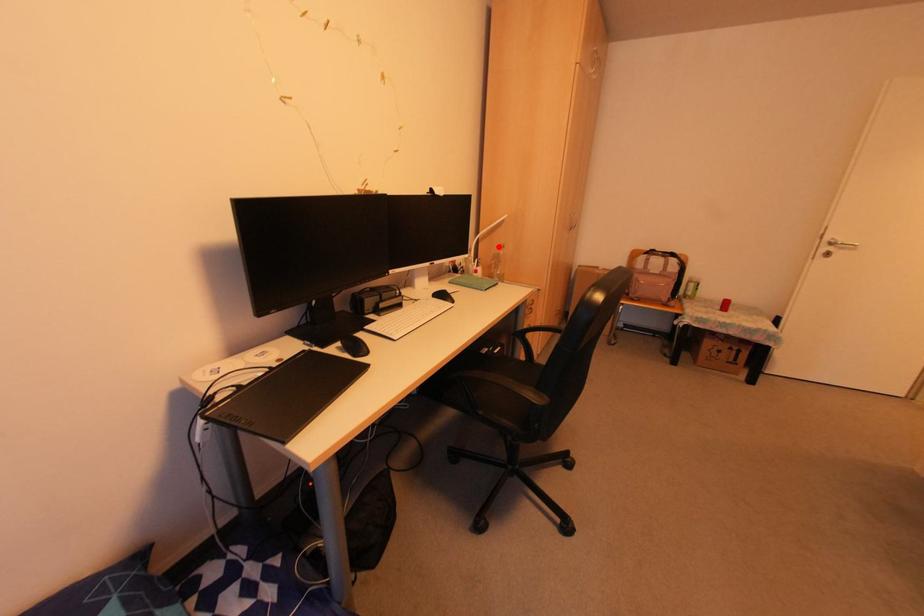
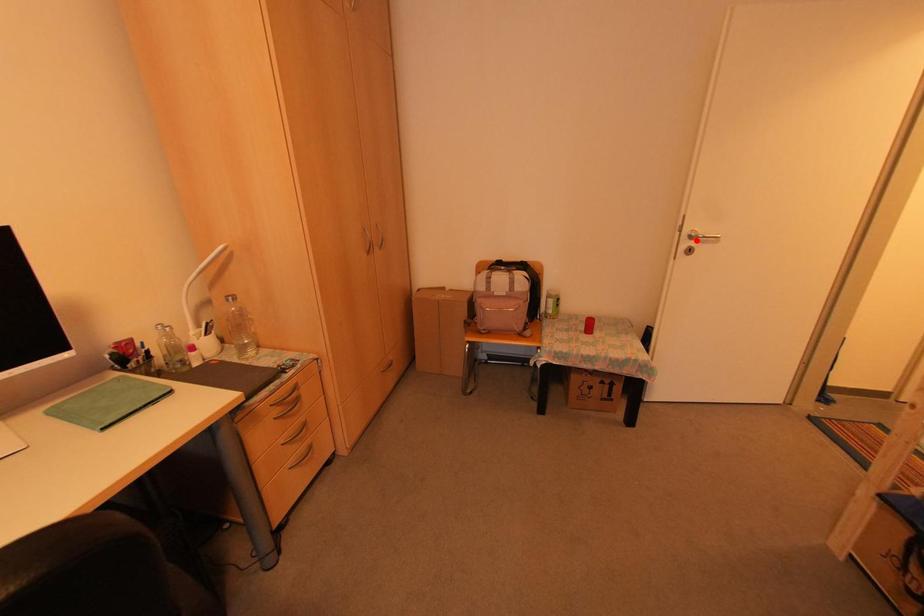
I am providing you with two images of the same scene from different viewpoints. A red point is marked on the first image and another point is marked on the second image. Do the highlighted points in image1 and image2 indicate the same real-world spot?

No